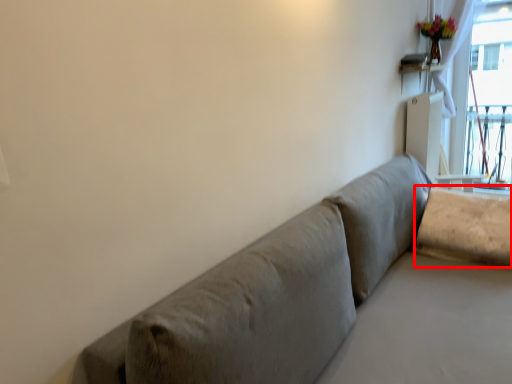
Question: Where is pillow (annotated by the red box) located in relation to table in the image?

Choices:
 (A) right
 (B) left

Answer: (B)